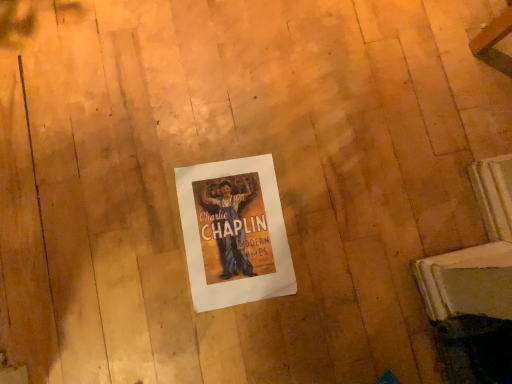
Locate an element on the screen. Image resolution: width=512 pixels, height=384 pixels. unoccupied region to the right of white paper poster at center is located at coordinates (345, 234).